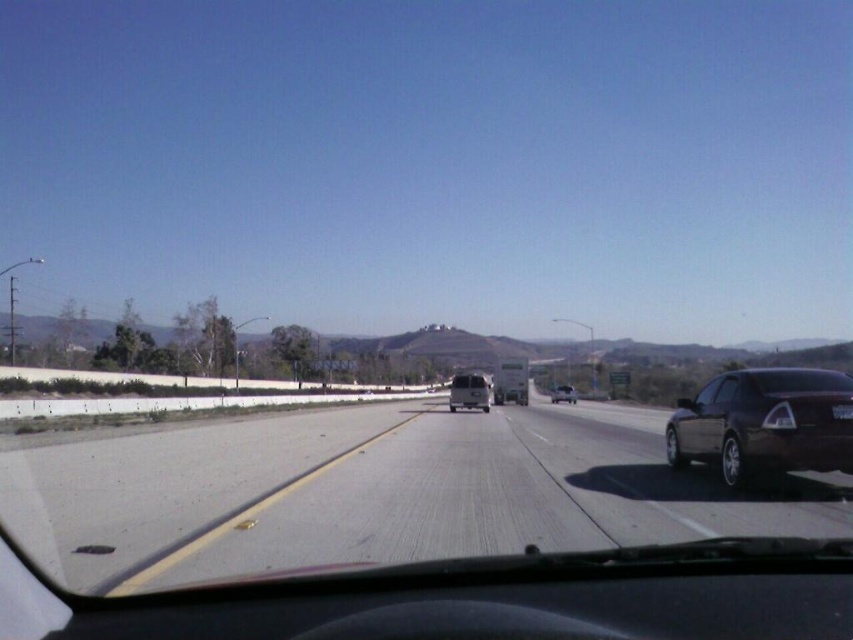
In the scene shown: Can you confirm if satin dark brown sedan at right is bigger than shiny silver sedan at center?

No.

Who is higher up, satin dark brown sedan at right or shiny silver sedan at center?

satin dark brown sedan at right is above.

This screenshot has width=853, height=640. In order to click on satin dark brown sedan at right in this screenshot , I will do pos(764,422).

Can you confirm if matte silver van at center is positioned to the right of shiny silver sedan at center?

No, matte silver van at center is not to the right of shiny silver sedan at center.

Between matte silver van at center and shiny silver sedan at center, which one is positioned lower?

shiny silver sedan at center is below.

You are a GUI agent. You are given a task and a screenshot of the screen. Output one action in this format:
    pyautogui.click(x=<x>, y=<y>)
    Task: Click on the matte silver van at center
    This screenshot has width=853, height=640.
    Given the screenshot: What is the action you would take?
    pyautogui.click(x=469, y=392)

Does point (654, 493) come farther from viewer compared to point (730, 417)?

No, (654, 493) is closer to viewer.

Can you confirm if asphalt road at center is taller than satin dark brown sedan at right?

Incorrect, asphalt road at center's height is not larger of satin dark brown sedan at right's.

Find the location of a particular element. The height and width of the screenshot is (640, 853). asphalt road at center is located at coordinates (376, 492).

The height and width of the screenshot is (640, 853). I want to click on asphalt road at center, so click(x=376, y=492).